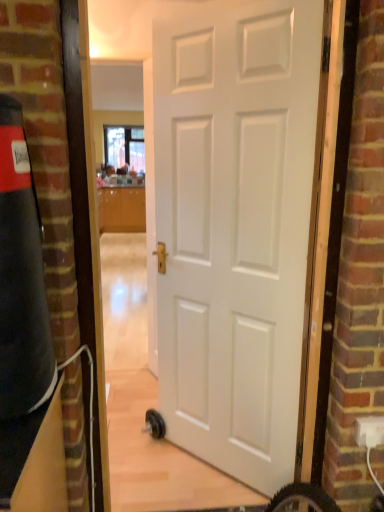
Question: From a real-world perspective, relative to white matte door at center, is clear glass window at upper center vertically above or below?

Choices:
 (A) above
 (B) below

Answer: (A)

Question: Is clear glass window at upper center to the left or to the right of white matte door at center in the image?

Choices:
 (A) right
 (B) left

Answer: (B)

Question: Estimate the real-world distances between objects in this image. Which object is closer to the glossy wood cabinetry at center?

Choices:
 (A) white plastic electric outlet at lower right
 (B) clear glass window at upper center
 (C) white matte door at center

Answer: (B)

Question: Which is nearer to the white matte door at center?

Choices:
 (A) white plastic electric outlet at lower right
 (B) clear glass window at upper center
 (C) glossy wood cabinetry at center

Answer: (A)